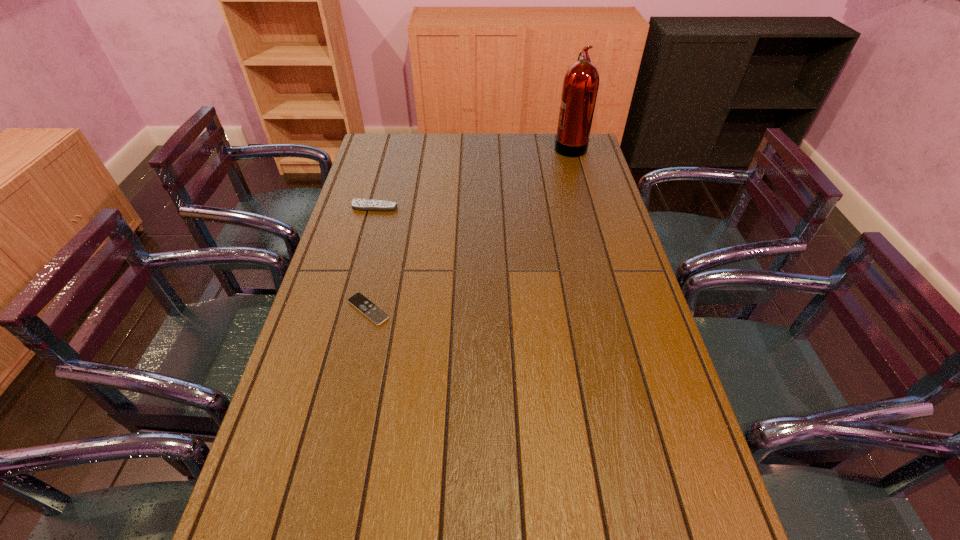
This screenshot has width=960, height=540. I want to click on vacant space that satisfies the following two spatial constraints: 1. on the front-facing side of the fire extinguisher; 2. on the front side of the farther remote control, so click(587, 207).

Locate an element on the screen. The height and width of the screenshot is (540, 960). vacant area in the image that satisfies the following two spatial constraints: 1. on the front-facing side of the rightmost object; 2. on the front side of the shortest object is located at coordinates (614, 309).